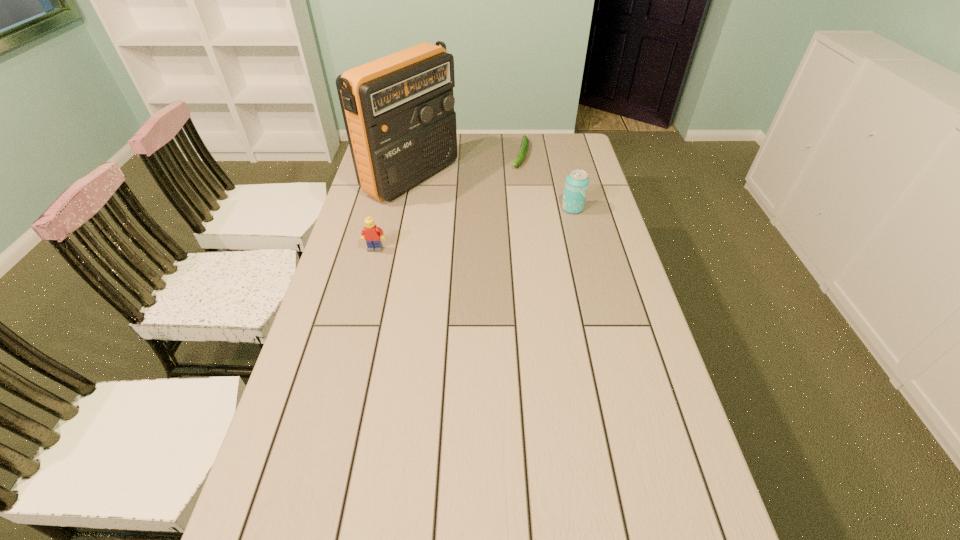
This screenshot has height=540, width=960. Find the location of `Lego`. Lego is located at coordinates (371, 233).

This screenshot has width=960, height=540. Find the location of `beer can`. beer can is located at coordinates (577, 181).

At what (x,y) coordinates should I click in order to perform the action: click on zucchini. Please return your answer as a coordinate pair (x, y). This screenshot has height=540, width=960. Looking at the image, I should click on (524, 147).

The image size is (960, 540). I want to click on the second object from right to left, so click(x=524, y=147).

Find the location of a particular element. radio receiver is located at coordinates (398, 110).

Where is `vacant area located on the front-facing side of the nearest object`? Image resolution: width=960 pixels, height=540 pixels. vacant area located on the front-facing side of the nearest object is located at coordinates (353, 335).

Locate an element on the screen. This screenshot has width=960, height=540. vacant space located 0.330m on the left of the beer can is located at coordinates (468, 208).

Locate an element on the screen. Image resolution: width=960 pixels, height=540 pixels. vacant position located on the front-facing side of the second object from right to left is located at coordinates (517, 177).

Locate an element on the screen. This screenshot has width=960, height=540. blank space located 0.350m on the front-facing side of the second object from right to left is located at coordinates (501, 223).

This screenshot has width=960, height=540. What are the coordinates of `vacant position located on the front-facing side of the second object from right to left` in the screenshot? It's located at (507, 208).